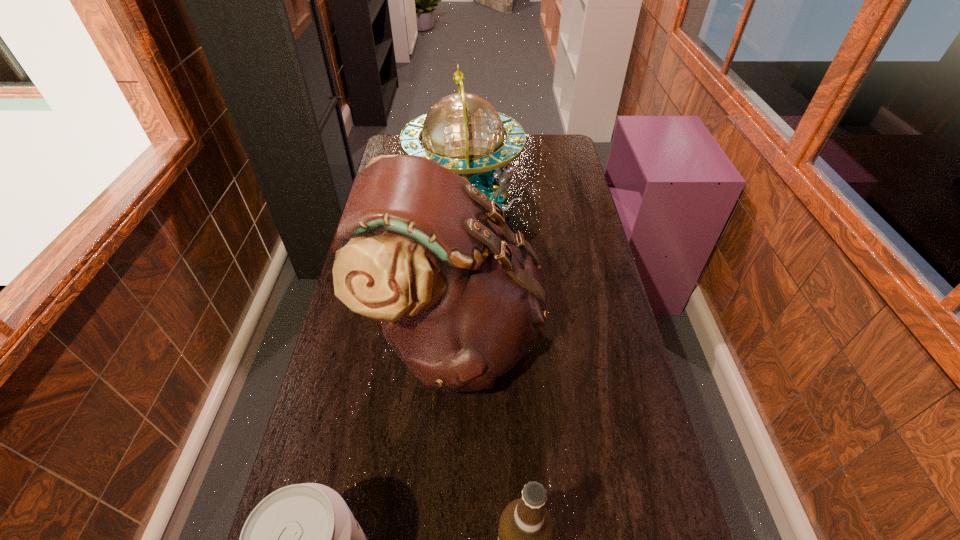
Identify the location of vacant region at the far right corner of the desktop. The width and height of the screenshot is (960, 540). (555, 147).

Find the location of `object that is the third nearest to the globe`. object that is the third nearest to the globe is located at coordinates (525, 535).

Identify which object is the closest to the satchel. Please provide its 2D coordinates. Your answer should be formatted as a tuple, i.e. [(x, y)], where the tuple contains the x and y coordinates of a point satisfying the conditions above.

[(463, 132)]